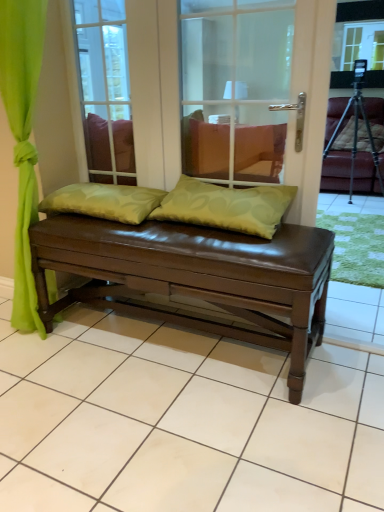
Question: Is point (340, 177) positioned closer to the camera than point (137, 189)?

Choices:
 (A) closer
 (B) farther

Answer: (B)

Question: From the image's perspective, relative to green fabric pillow at center, which ranks as the second pillow in right-to-left order, is leather armchair at right above or below?

Choices:
 (A) below
 (B) above

Answer: (B)

Question: Estimate the real-world distances between objects in this image. Which object is farther from the transparent glass door at center?

Choices:
 (A) green fabric pillow at center, which ranks as the second pillow in right-to-left order
 (B) brown leather bench at center
 (C) green fabric pillow at center, the 2th pillow when ordered from left to right
 (D) brown leather bench at center
 (E) transparent glass window screen at upper center

Answer: (E)

Question: Which object is positioned closest to the brown leather bench at center?

Choices:
 (A) green fabric pillow at center, the 2th pillow when ordered from left to right
 (B) leather armchair at right
 (C) transparent glass window screen at upper center
 (D) green fabric pillow at center, which ranks as the second pillow in right-to-left order
 (E) brown leather bench at center

Answer: (A)